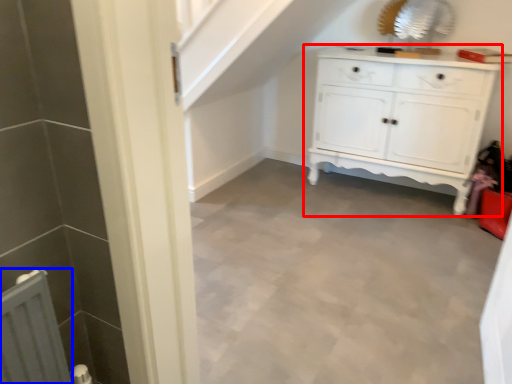
Question: Among these objects, which one is nearest to the camera, chest of drawers (highlighted by a red box) or radiator (highlighted by a blue box)?

Choices:
 (A) chest of drawers
 (B) radiator

Answer: (B)